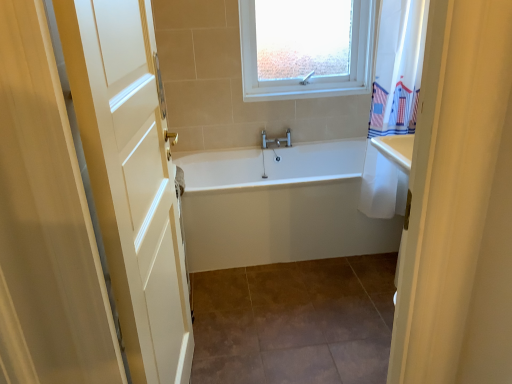
Question: From the image's perspective, is white glossy bathtub at center located above or below white wood door at left?

Choices:
 (A) above
 (B) below

Answer: (A)

Question: In the image, is white glossy bathtub at center positioned in front of or behind white wood door at left?

Choices:
 (A) front
 (B) behind

Answer: (B)

Question: Which is nearer to the white glossy bathtub at center?

Choices:
 (A) white wood door at left
 (B) brown tile at center
 (C) white plastic window at upper center

Answer: (B)

Question: Which object is positioned farthest from the white glossy bathtub at center?

Choices:
 (A) brown tile at center
 (B) white wood door at left
 (C) white plastic window at upper center

Answer: (C)